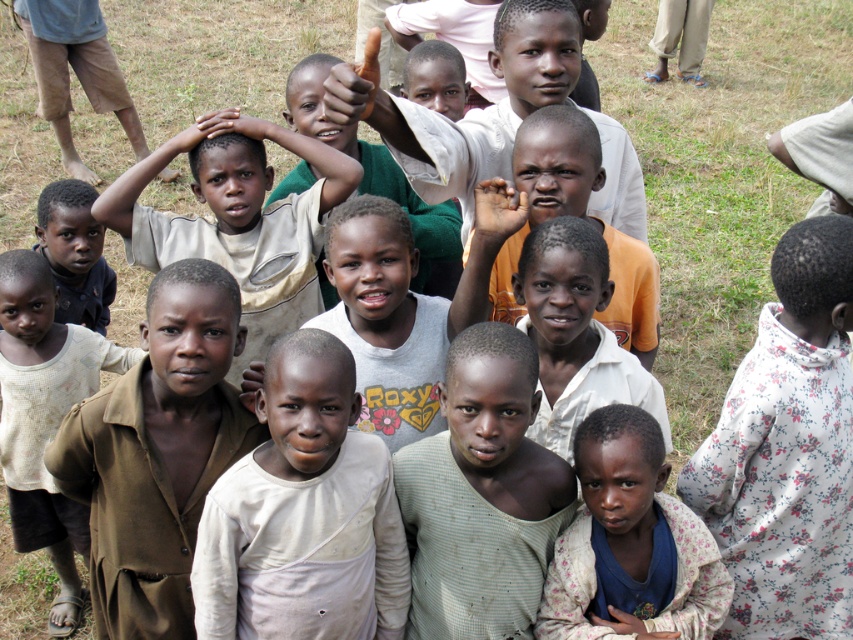
You are standing at the center of the field and see the light blue fabric shirt at lower right. Can you determine if the shirt is closer to the edge of the field or the center based on its position?

The light blue fabric shirt at lower right is located at point (630, 541), which is closer to the edge of the field than the center.

You are a photographer trying to position a new subject in the image so that they are exactly 0.2 meters to the right of the brown matte shirt at center. What coordinate should you aim for if the shirt is at point 0.708, 0.185?

The brown matte shirt at center is located at point (x=157, y=452). To position the new subject 0.2 meters to the right, you would aim for the coordinate 0.708 plus 0.2 meters in the x direction.